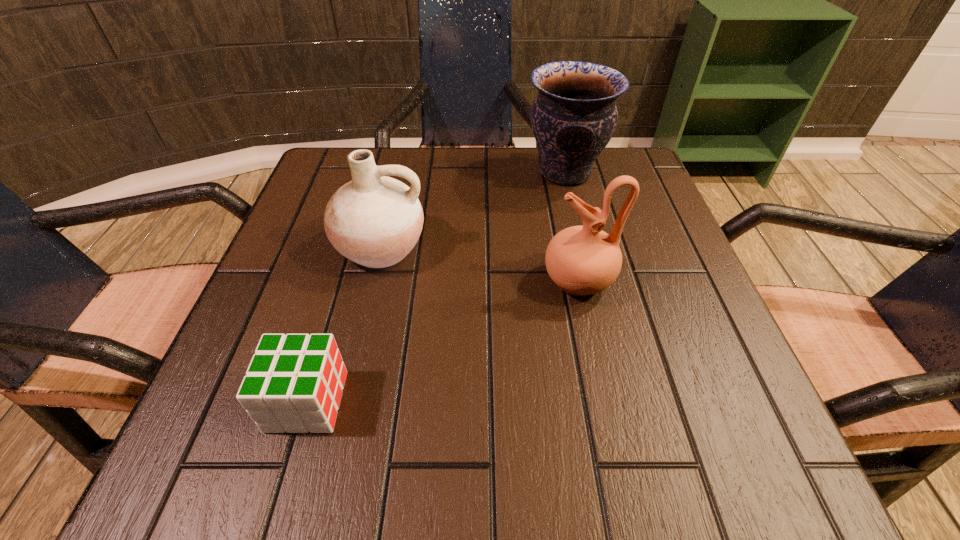
Find the location of a particular element. The image size is (960, 540). object that can be found as the second closest to the farthest pottery is located at coordinates (374, 220).

Where is `object that is the third closest to the nearest object`? object that is the third closest to the nearest object is located at coordinates (574, 117).

Locate an element on the screen. Image resolution: width=960 pixels, height=540 pixels. pottery that stands as the second closest to the farthest pottery is located at coordinates (374, 220).

Select which pottery is the closest to the farthest pottery. Please provide its 2D coordinates. Your answer should be formatted as a tuple, i.e. [(x, y)], where the tuple contains the x and y coordinates of a point satisfying the conditions above.

[(582, 260)]

This screenshot has width=960, height=540. Identify the location of vacant space that satisfies the following two spatial constraints: 1. to pour from the handle of the leftmost pottery; 2. on the red face of the cube. (345, 401).

Where is `free spot that satisfies the following two spatial constraints: 1. on the front handle of the farthest object; 2. to pour from the handle of the leftmost pottery`? This screenshot has height=540, width=960. free spot that satisfies the following two spatial constraints: 1. on the front handle of the farthest object; 2. to pour from the handle of the leftmost pottery is located at coordinates (584, 247).